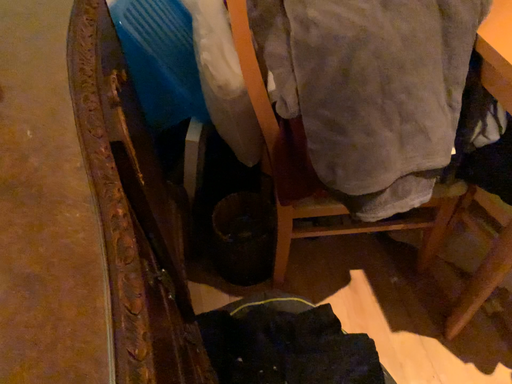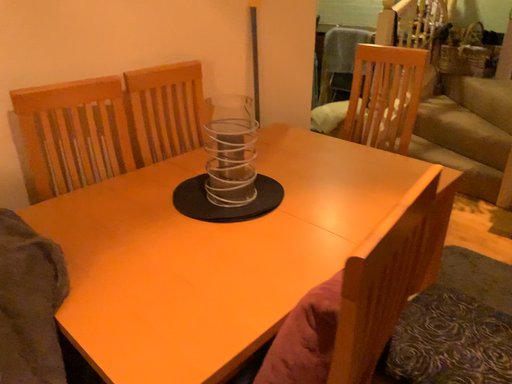
Question: Which way did the camera rotate in the video?

Choices:
 (A) rotated right
 (B) rotated left

Answer: (A)